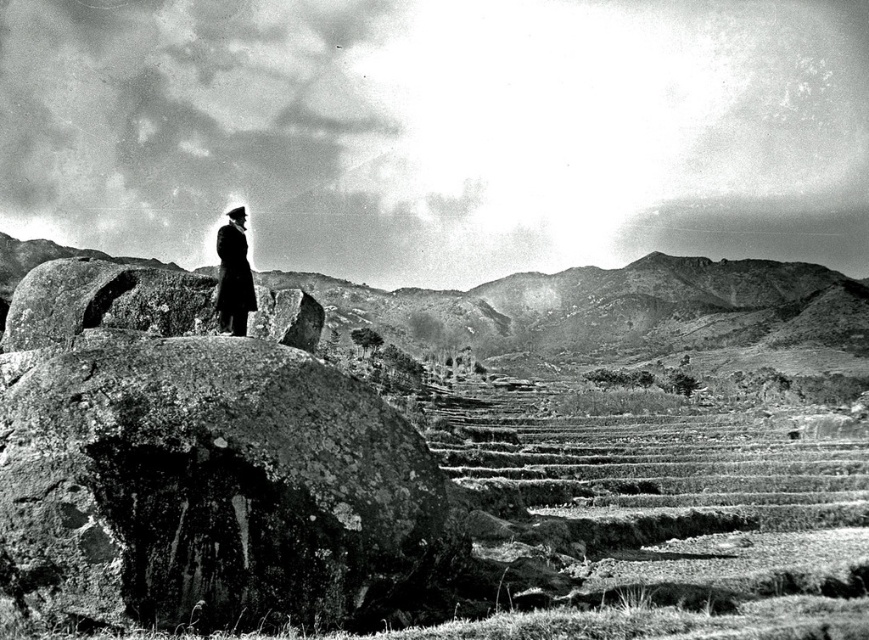
Can you confirm if rough stone boulder at center-left is taller than dark wool coat at center?

Indeed, rough stone boulder at center-left has a greater height compared to dark wool coat at center.

What do you see at coordinates (216, 486) in the screenshot? I see `rough stone boulder at center-left` at bounding box center [216, 486].

Who is more forward, (253, 349) or (236, 216)?

Point (253, 349)

Locate an element on the screen. The image size is (869, 640). rough stone boulder at center-left is located at coordinates (216, 486).